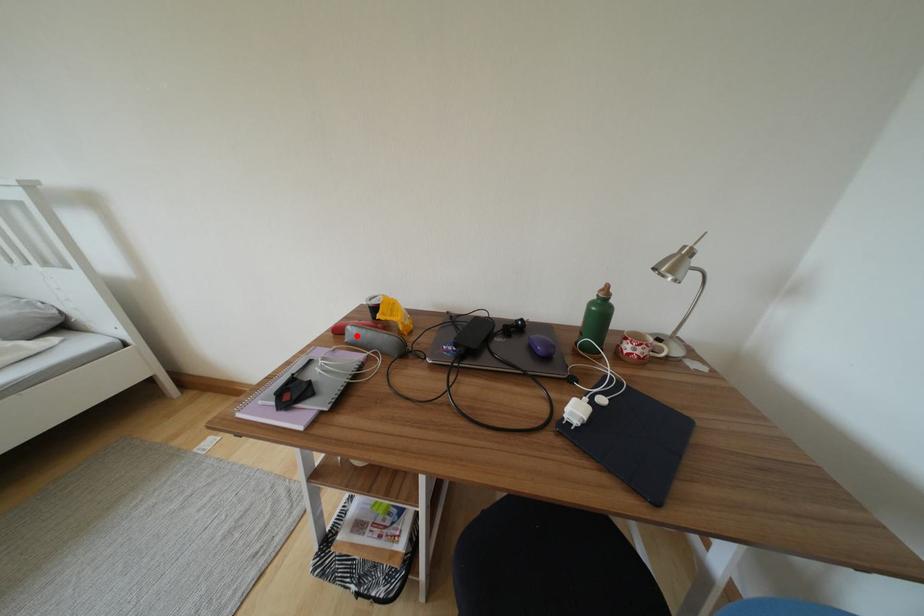
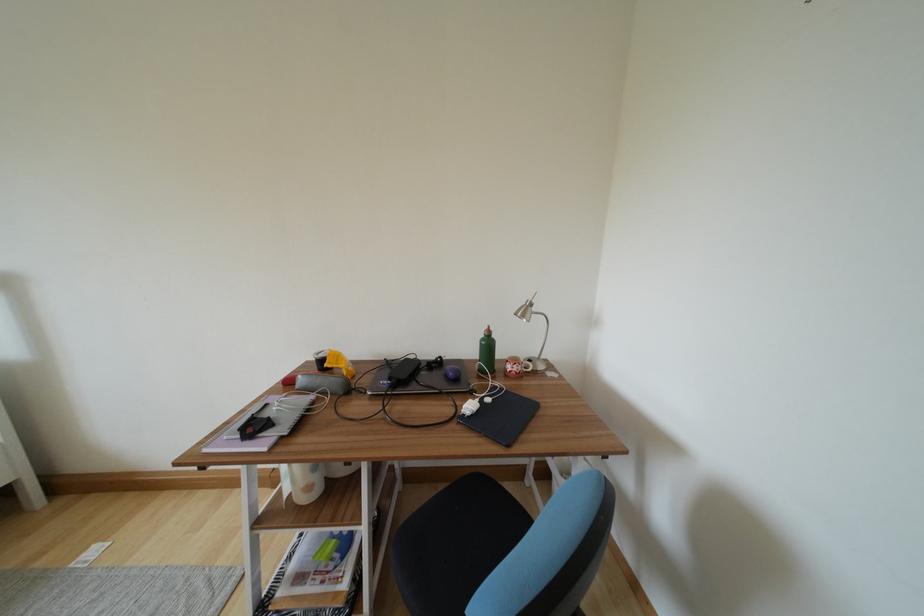
The point at the highlighted location is marked in the first image. Where is the corresponding point in the second image?

(306, 385)